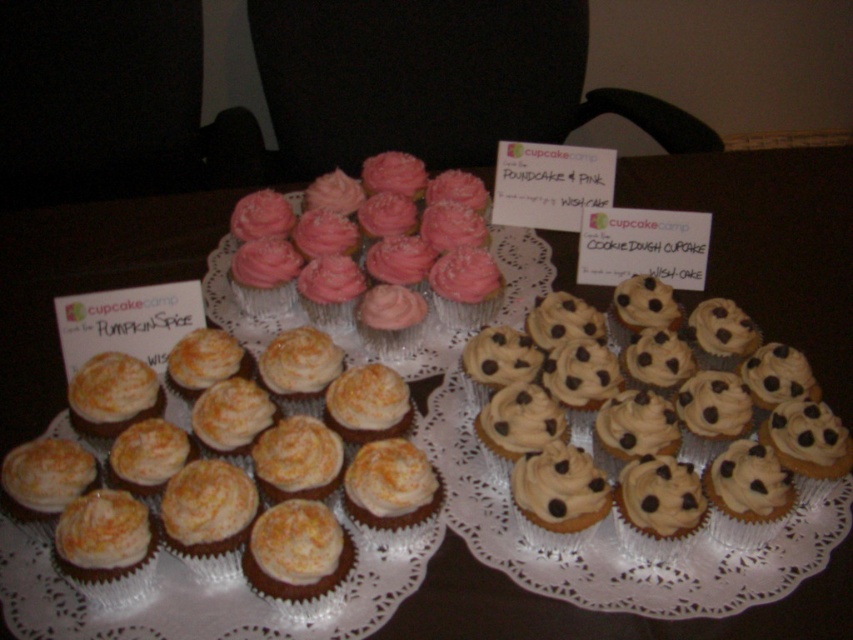
Question: Which point appears farthest from the camera in this image?

Choices:
 (A) (399, 212)
 (B) (404, 387)
 (C) (109, 598)
 (D) (479, 376)

Answer: (A)

Question: Which of the following is the closest to the observer?

Choices:
 (A) matte orange frosting cupcake at lower left
 (B) pink frosted cupcake at center
 (C) orange frosted cupcake at center

Answer: (A)

Question: Can you confirm if chocolate frosted cupcake at center is positioned above matte orange cupcake at lower left?

Choices:
 (A) yes
 (B) no

Answer: (B)

Question: Can you confirm if matte orange frosting cupcake at left is positioned to the left of chocolate chip cookie dough cupcake at center?

Choices:
 (A) yes
 (B) no

Answer: (A)

Question: Does matte orange cupcake at lower left appear over orange frosted cupcake at center?

Choices:
 (A) no
 (B) yes

Answer: (B)

Question: Estimate the real-world distances between objects in this image. Which object is closer to the orange frosted cupcake at center?

Choices:
 (A) matte orange frosting cupcake at left
 (B) matte orange frosting cupcake at lower left
 (C) chocolate frosted cupcake at center

Answer: (A)